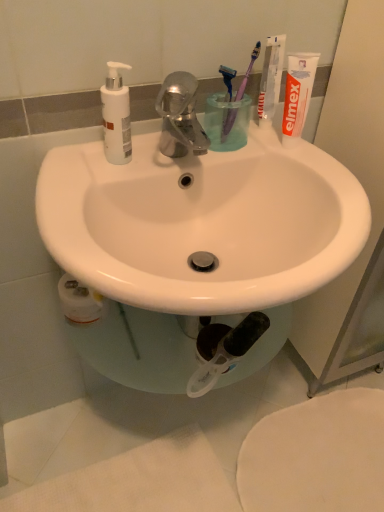
At what (x,y) coordinates should I click in order to perform the action: click on vacant space to the left of white matte tube of toothpaste at upper right, the first toothpaste when ordered from right to left. Please return your answer as a coordinate pair (x, y). This screenshot has width=384, height=512. Looking at the image, I should click on (211, 146).